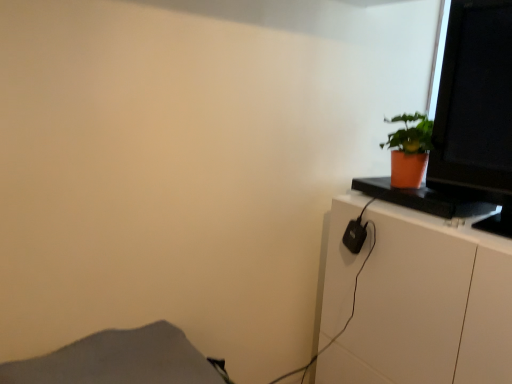
Measure the distance between matte black monitor at upper right and camera.

matte black monitor at upper right and camera are 3.73 feet apart.

Where is `matte black monitor at upper right`? The width and height of the screenshot is (512, 384). matte black monitor at upper right is located at coordinates (476, 110).

This screenshot has width=512, height=384. What do you see at coordinates (409, 150) in the screenshot?
I see `orange matte pot at upper right` at bounding box center [409, 150].

This screenshot has height=384, width=512. Describe the element at coordinates (118, 360) in the screenshot. I see `gray fabric at lower left` at that location.

Locate an element on the screen. The width and height of the screenshot is (512, 384). white glossy cabinet at right is located at coordinates (x=426, y=306).

Considering the relative sizes of white glossy cabinet at right and gray fabric at lower left in the image provided, is white glossy cabinet at right wider than gray fabric at lower left?

Correct, the width of white glossy cabinet at right exceeds that of gray fabric at lower left.

Which of these two, white glossy cabinet at right or gray fabric at lower left, is bigger?

white glossy cabinet at right is bigger.

Is white glossy cabinet at right facing away from gray fabric at lower left?

No.

Is the position of matte black monitor at upper right more distant than that of white glossy cabinet at right?

Yes, matte black monitor at upper right is further from the camera.

Between matte black monitor at upper right and white glossy cabinet at right, which one has larger width?

white glossy cabinet at right is wider.

Could you tell me if matte black monitor at upper right is turned towards white glossy cabinet at right?

No, matte black monitor at upper right is not oriented towards white glossy cabinet at right.

Considering the points (428, 167) and (360, 358), which point is in front, point (428, 167) or point (360, 358)?

The point (428, 167) is more forward.

Considering the positions of objects orange matte pot at upper right and gray fabric at lower left in the image provided, who is behind, orange matte pot at upper right or gray fabric at lower left?

orange matte pot at upper right is further away from the camera.

From the picture: Is orange matte pot at upper right next to gray fabric at lower left?

No, orange matte pot at upper right is not touching gray fabric at lower left.

From the image's perspective, which is below, orange matte pot at upper right or gray fabric at lower left?

gray fabric at lower left, from the image's perspective.

From a real-world perspective, is orange matte pot at upper right positioned over matte black monitor at upper right based on gravity?

Incorrect, from a real-world perspective, orange matte pot at upper right is lower than matte black monitor at upper right.

Could you tell me if orange matte pot at upper right is turned towards matte black monitor at upper right?

No, orange matte pot at upper right does not turn towards matte black monitor at upper right.

How many degrees apart are the facing directions of orange matte pot at upper right and matte black monitor at upper right?

There is a 7.41e-05-degree angle between the facing directions of orange matte pot at upper right and matte black monitor at upper right.

Considering the relative sizes of orange matte pot at upper right and matte black monitor at upper right in the image provided, is orange matte pot at upper right smaller than matte black monitor at upper right?

Indeed, orange matte pot at upper right has a smaller size compared to matte black monitor at upper right.

Between white glossy cabinet at right and orange matte pot at upper right, which one has smaller width?

Thinner between the two is orange matte pot at upper right.

Does point (329, 309) lie in front of point (409, 127)?

No, it is behind (409, 127).

From a real-world perspective, is white glossy cabinet at right physically located above or below orange matte pot at upper right?

white glossy cabinet at right is situated lower than orange matte pot at upper right in the real world.

Identify the location of houseplant on the left of the white glossy cabinet at right. The height and width of the screenshot is (384, 512). (409, 150).

Looking at their sizes, would you say gray fabric at lower left is wider or thinner than matte black monitor at upper right?

Clearly, gray fabric at lower left has more width compared to matte black monitor at upper right.

Which is in front, point (156, 363) or point (509, 39)?

The point (156, 363) is closer.

What's the angular difference between gray fabric at lower left and matte black monitor at upper right's facing directions?

The angle between the facing direction of gray fabric at lower left and the facing direction of matte black monitor at upper right is 89.8 degrees.

Does gray fabric at lower left have a larger size compared to matte black monitor at upper right?

Incorrect, gray fabric at lower left is not larger than matte black monitor at upper right.

Is matte black monitor at upper right inside the boundaries of gray fabric at lower left, or outside?

matte black monitor at upper right is spatially situated outside gray fabric at lower left.

From the picture: Is matte black monitor at upper right aimed at gray fabric at lower left?

Yes, matte black monitor at upper right is turned towards gray fabric at lower left.

Which is behind, matte black monitor at upper right or gray fabric at lower left?

Positioned behind is matte black monitor at upper right.

Does point (438, 176) come farther from viewer compared to point (140, 357)?

Yes, it is.

Find the location of a particular element. The image size is (512, 384). cabinetry lying below the gray fabric at lower left (from the image's perspective) is located at coordinates point(426,306).

Where is `computer monitor that appears above the white glossy cabinet at right (from a real-world perspective)`? This screenshot has width=512, height=384. computer monitor that appears above the white glossy cabinet at right (from a real-world perspective) is located at coordinates (476, 110).

When comparing their distances from matte black monitor at upper right, does orange matte pot at upper right or gray fabric at lower left seem further?

gray fabric at lower left is positioned further to the anchor matte black monitor at upper right.

When comparing their distances from gray fabric at lower left, does orange matte pot at upper right or white glossy cabinet at right seem further?

orange matte pot at upper right is positioned further to the anchor gray fabric at lower left.

When comparing their distances from orange matte pot at upper right, does white glossy cabinet at right or gray fabric at lower left seem closer?

white glossy cabinet at right lies closer to orange matte pot at upper right than the other object.

When comparing their distances from white glossy cabinet at right, does matte black monitor at upper right or gray fabric at lower left seem further?

gray fabric at lower left is further to white glossy cabinet at right.

When comparing their distances from orange matte pot at upper right, does gray fabric at lower left or matte black monitor at upper right seem closer?

matte black monitor at upper right is positioned closer to the anchor orange matte pot at upper right.

Looking at the image, which one is located further to gray fabric at lower left, matte black monitor at upper right or orange matte pot at upper right?

The object further to gray fabric at lower left is matte black monitor at upper right.

Estimate the real-world distances between objects in this image. Which object is closer to orange matte pot at upper right, white glossy cabinet at right or matte black monitor at upper right?

matte black monitor at upper right is positioned closer to the anchor orange matte pot at upper right.

In the scene shown: Based on their spatial positions, is matte black monitor at upper right or white glossy cabinet at right closer to orange matte pot at upper right?

Based on the image, matte black monitor at upper right appears to be nearer to orange matte pot at upper right.

Locate an element on the screen. This screenshot has width=512, height=384. houseplant between matte black monitor at upper right and white glossy cabinet at right in the up-down direction is located at coordinates (409, 150).

In order to click on cabinetry situated between gray fabric at lower left and matte black monitor at upper right from left to right in this screenshot , I will do `click(426, 306)`.

The height and width of the screenshot is (384, 512). In order to click on houseplant between gray fabric at lower left and white glossy cabinet at right from left to right in this screenshot , I will do `click(409, 150)`.

At what (x,y) coordinates should I click in order to perform the action: click on houseplant between gray fabric at lower left and matte black monitor at upper right from left to right. Please return your answer as a coordinate pair (x, y). Looking at the image, I should click on (409, 150).